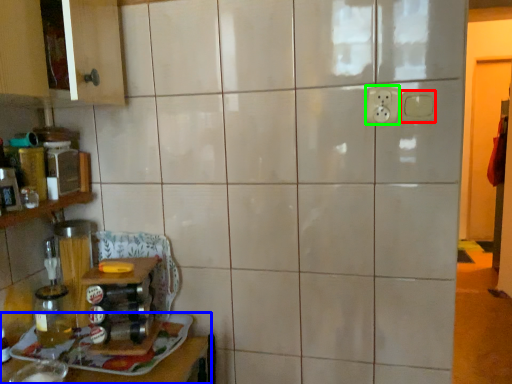
Question: Based on their relative distances, which object is nearer to electric outlet (highlighted by a red box)? Choose from furniture (highlighted by a blue box) and electric outlet (highlighted by a green box).

Choices:
 (A) furniture
 (B) electric outlet

Answer: (B)